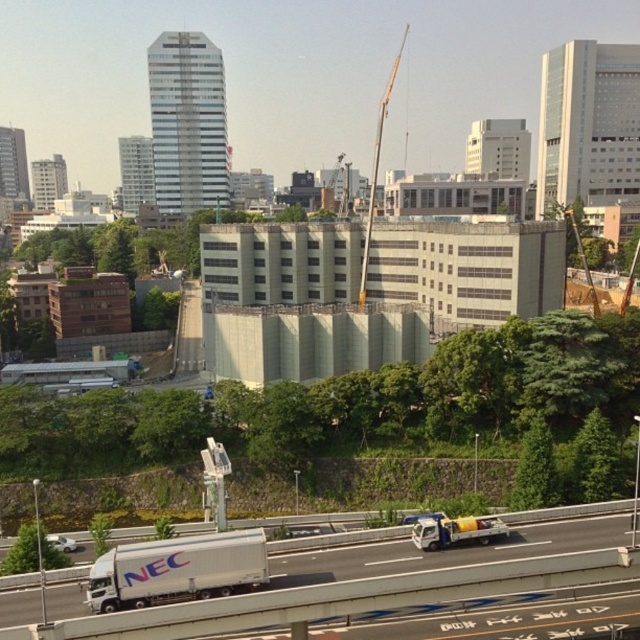
You are a delivery driver who needs to park your white matte trailer truck at lower left at a specific coordinate. What are the coordinates where you should park it?

The white matte trailer truck at lower left should be parked at coordinates point [177,570].

You are a delivery driver who needs to park your truck near the construction site. You see the white matte trailer truck at lower left and the metallic gray crane at center. Which truck should you park closer to the crane to avoid blocking the road?

You should park the white matte trailer truck at lower left closer to the metallic gray crane at center since it is already positioned on the left side of the crane, minimizing the chance of blocking the road.

You are a construction worker standing at the entrance of the partially constructed building. You need to move towards the metallic gray crane at center. Which direction should you head in?

The metallic gray crane at center is located at point (378,168), so you should head towards the center of the image to reach it.